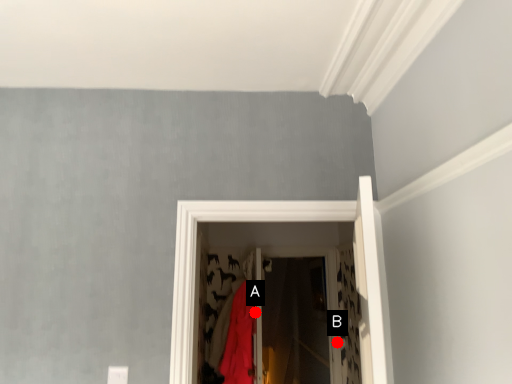
Question: Two points are circled on the image, labeled by A and B beside each circle. Which point is farther from the camera taking this photo?

Choices:
 (A) A is further
 (B) B is further

Answer: (B)